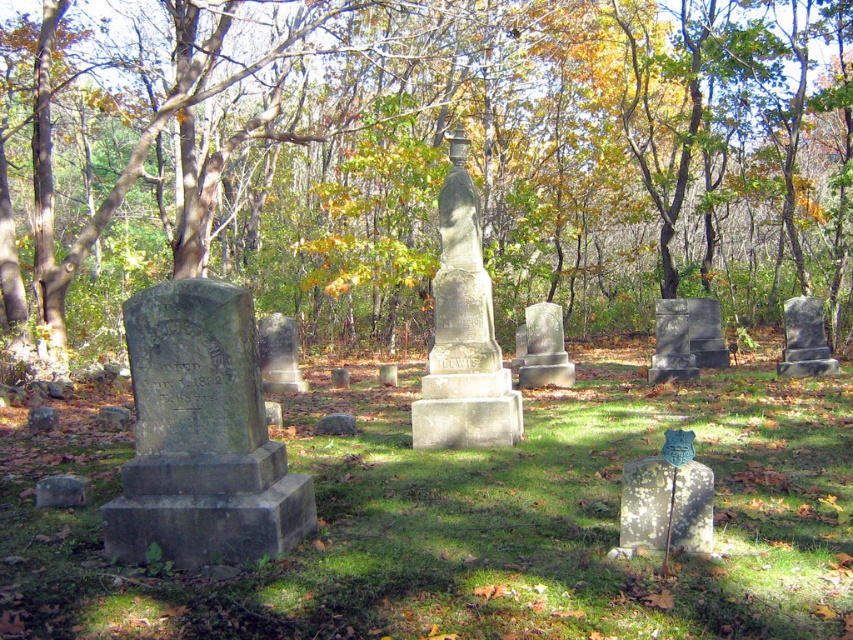
Question: Can you confirm if green leafy tree at center is positioned to the left of gray stone gravestone at center?

Choices:
 (A) yes
 (B) no

Answer: (A)

Question: Estimate the real-world distances between objects in this image. Which object is closer to the speckled stone gravestone at lower right?

Choices:
 (A) gray stone gravestone at lower left
 (B) gray stone gravestone at center

Answer: (A)

Question: Can you confirm if speckled stone gravestone at lower right is wider than gray stone gravestone at center?

Choices:
 (A) no
 (B) yes

Answer: (A)

Question: Is the position of dark gray stone gravestone at right more distant than that of gray stone gravestone at lower left?

Choices:
 (A) no
 (B) yes

Answer: (B)

Question: Based on their relative distances, which object is nearer to the dark gray stone gravestone at right?

Choices:
 (A) green leafy tree at center
 (B) speckled stone gravestone at lower right
 (C) gray stone gravestone at center
 (D) green grass at center

Answer: (C)

Question: Among these points, which one is farthest from the camera?

Choices:
 (A) (49, 486)
 (B) (709, 525)
 (C) (33, 499)

Answer: (C)